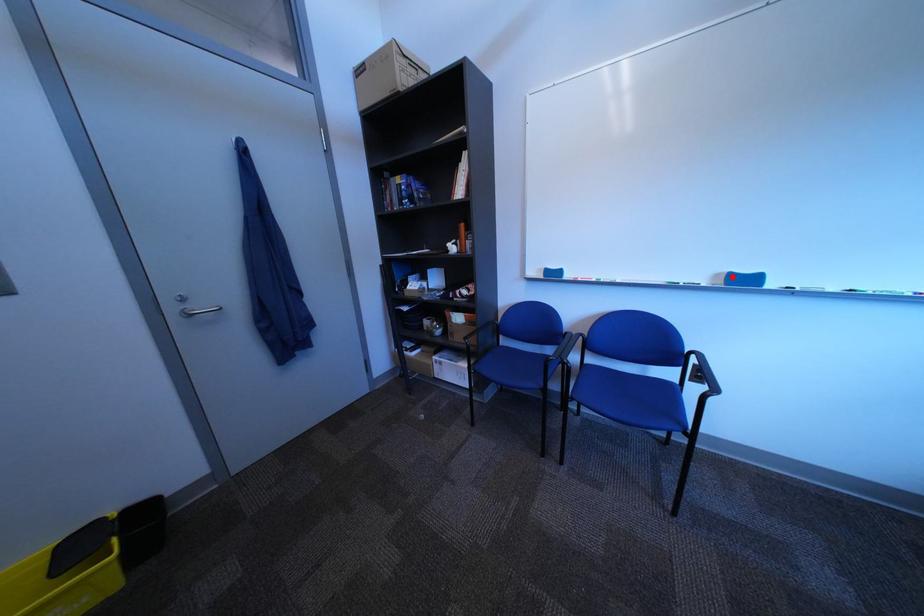
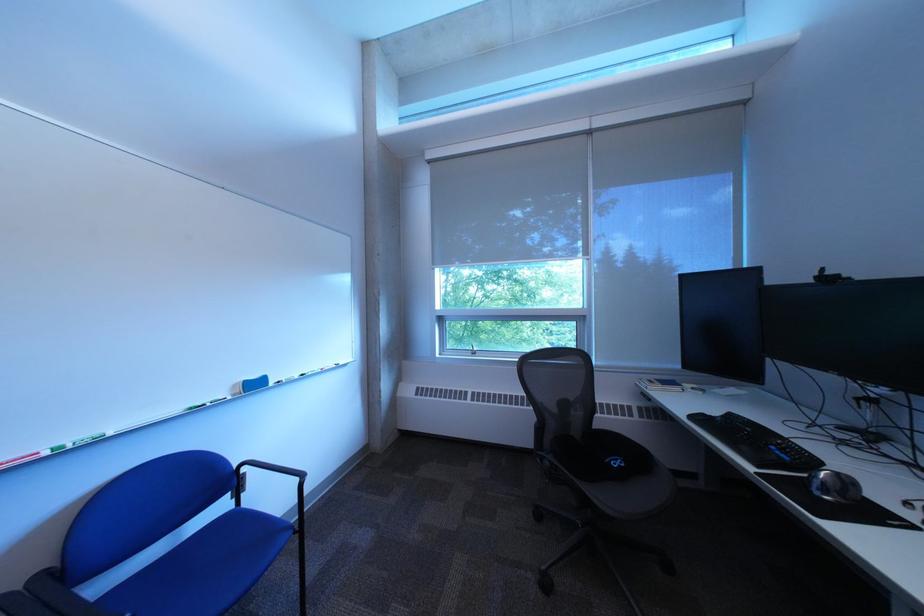
Where in the second image is the point corresponding to the highlighted location from the first image?

(249, 387)